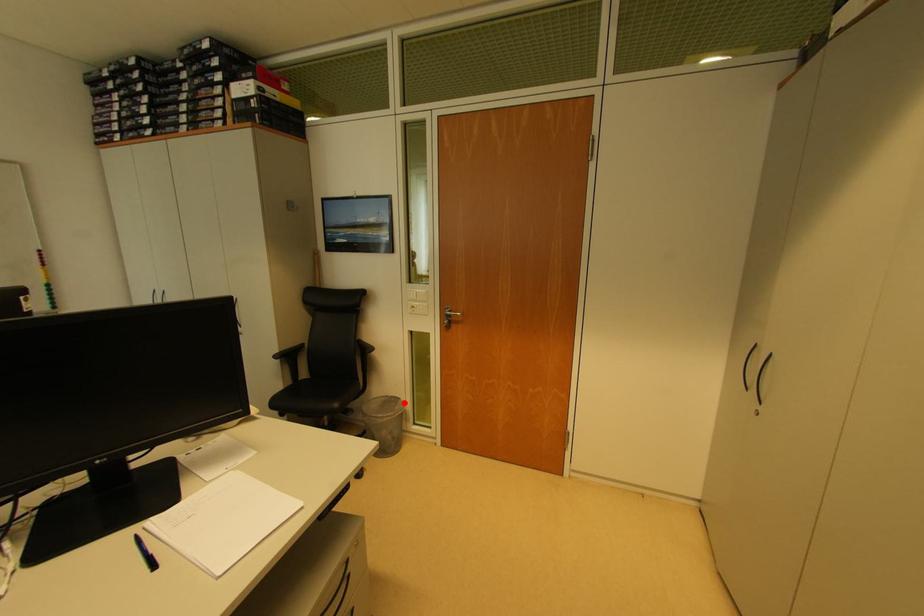
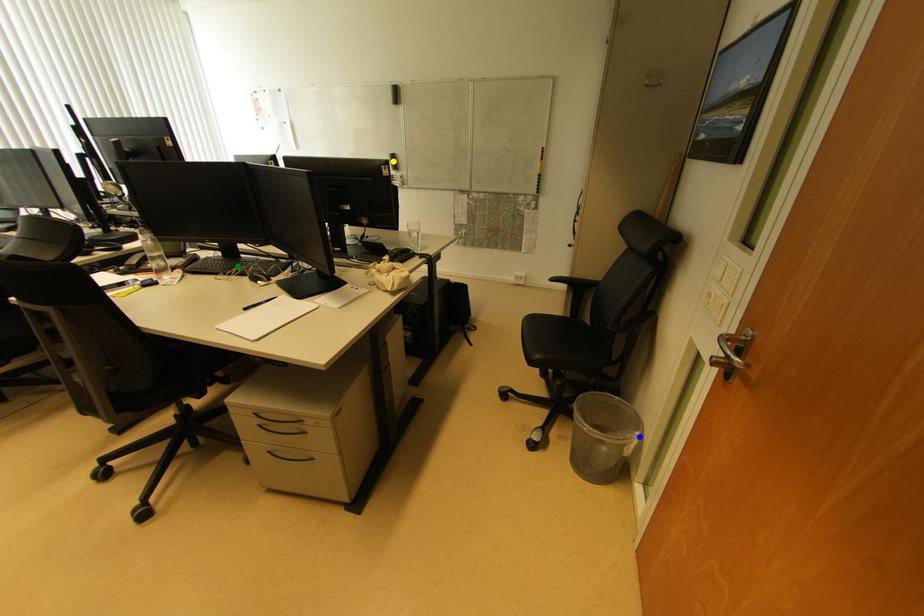
Question: I am providing you with two images of the same scene from different viewpoints. A red point is marked on the first image. You are given multiple points on the second image. Which point in image 2 is actually the same real-world point as the red point in image 1?

Choices:
 (A) green point
 (B) yellow point
 (C) blue point

Answer: (C)